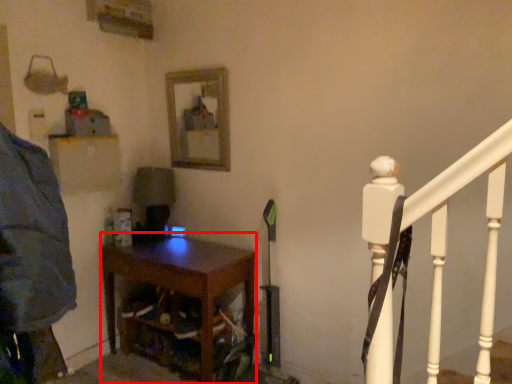
Question: Observing the image, what is the correct spatial positioning of nightstand (annotated by the red box) in reference to mirror?

Choices:
 (A) right
 (B) left

Answer: (B)